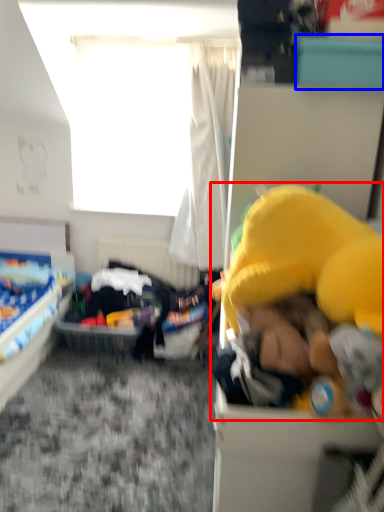
Question: Which of the following is the farthest to the observer, toy (highlighted by a red box) or box (highlighted by a blue box)?

Choices:
 (A) toy
 (B) box

Answer: (B)